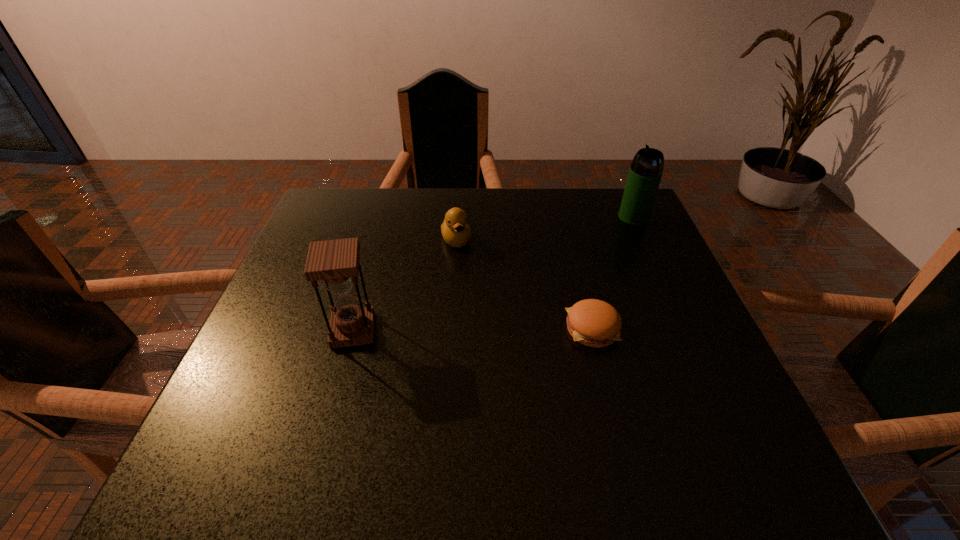
At what (x,y) coordinates should I click in order to perform the action: click on vacant space that's between the leftmost object and the thermos bottle. Please return your answer as a coordinate pair (x, y). Image resolution: width=960 pixels, height=540 pixels. Looking at the image, I should click on (493, 274).

This screenshot has height=540, width=960. Identify the location of vacant area between the second object from right to left and the duckling. (524, 285).

This screenshot has width=960, height=540. What are the coordinates of `unoccupied area between the shortest object and the third object from right to left` in the screenshot? It's located at (524, 285).

Where is `empty space between the second shortest object and the hourglass`? empty space between the second shortest object and the hourglass is located at coordinates (405, 285).

Locate an element on the screen. vacant region between the thermos bottle and the hourglass is located at coordinates (493, 274).

The width and height of the screenshot is (960, 540). Identify the location of free point between the duckling and the hourglass. (405, 285).

This screenshot has width=960, height=540. What are the coordinates of `object identified as the closest to the patty` in the screenshot? It's located at (455, 230).

Find the location of `object that can be found as the second closest to the thermos bottle`. object that can be found as the second closest to the thermos bottle is located at coordinates (455, 230).

Identify the location of free space that satisfies the following two spatial constraints: 1. on the back side of the third nearest object; 2. on the right side of the farthest object. (458, 217).

The image size is (960, 540). In order to click on vacant point that satisfies the following two spatial constraints: 1. on the front side of the duckling; 2. on the right side of the second object from right to left in this screenshot , I will do `click(450, 329)`.